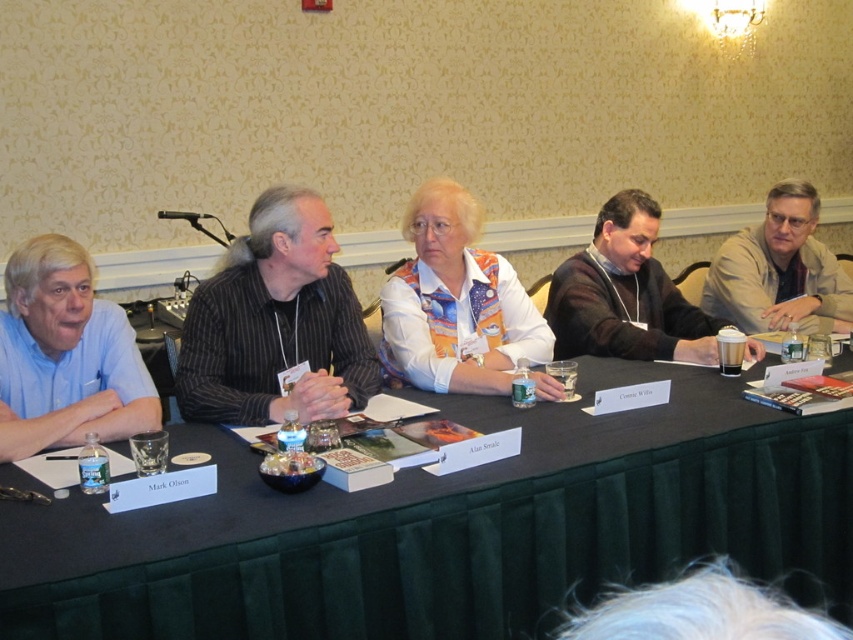
Question: Which object is the farthest from the blue shirt at left?

Choices:
 (A) dark brown sweater at center
 (B) white textured shirt at center

Answer: (A)

Question: Considering the relative positions of blue shirt at left and dark brown sweater at center in the image provided, where is blue shirt at left located with respect to dark brown sweater at center?

Choices:
 (A) left
 (B) right

Answer: (A)

Question: Is black striped shirt at center positioned in front of white textured shirt at center?

Choices:
 (A) yes
 (B) no

Answer: (A)

Question: Which point appears farthest from the camera in this image?

Choices:
 (A) (785, 218)
 (B) (572, 320)
 (C) (28, 445)

Answer: (A)

Question: Does green fabric table at center appear on the left side of white textured shirt at center?

Choices:
 (A) yes
 (B) no

Answer: (B)

Question: Which of the following is the farthest from the observer?

Choices:
 (A) (267, 240)
 (B) (432, 294)
 (C) (838, 316)

Answer: (C)